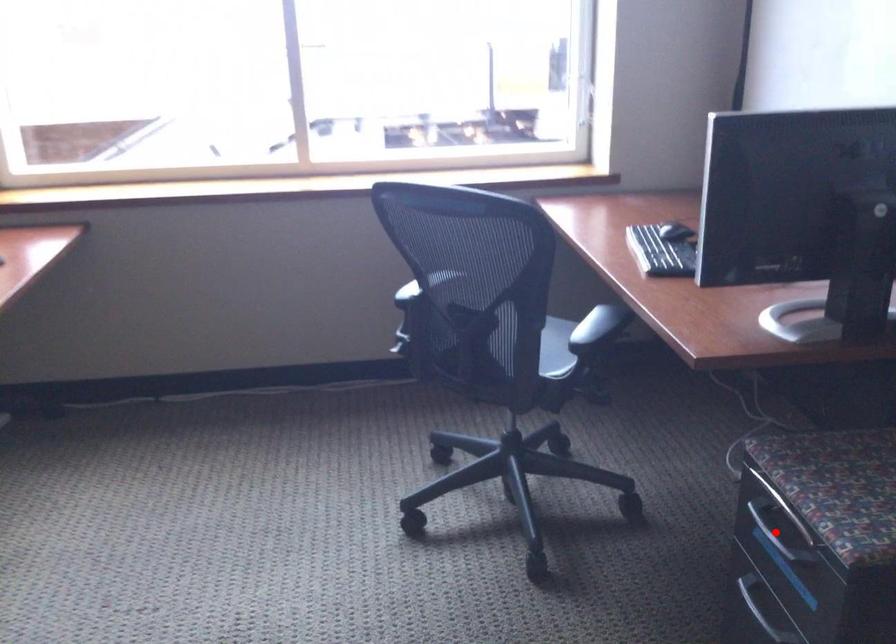
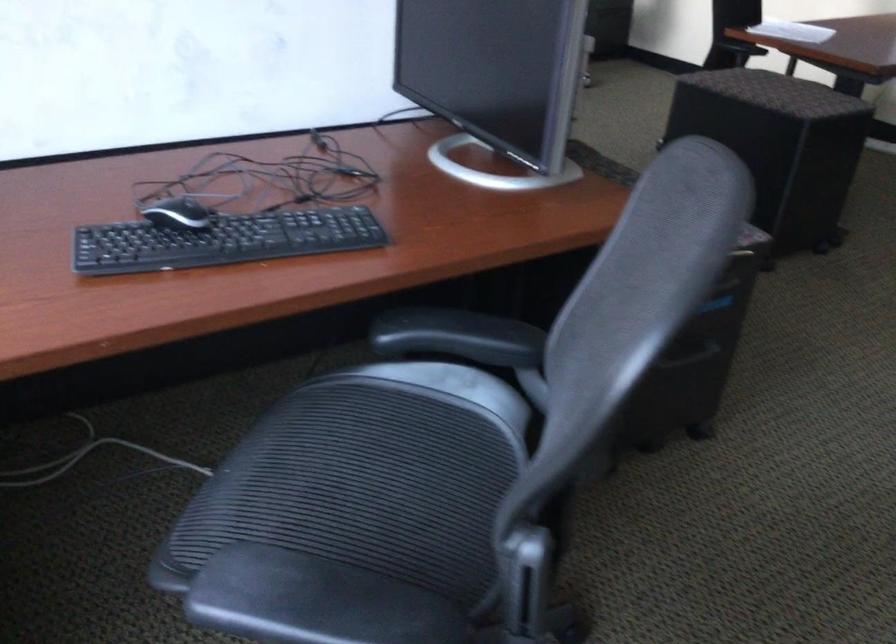
Question: I am providing you with two images of the same scene from different viewpoints. A red point is marked on the first image. Can you still see the location of the red point in image 2?

Choices:
 (A) Yes
 (B) No

Answer: (B)